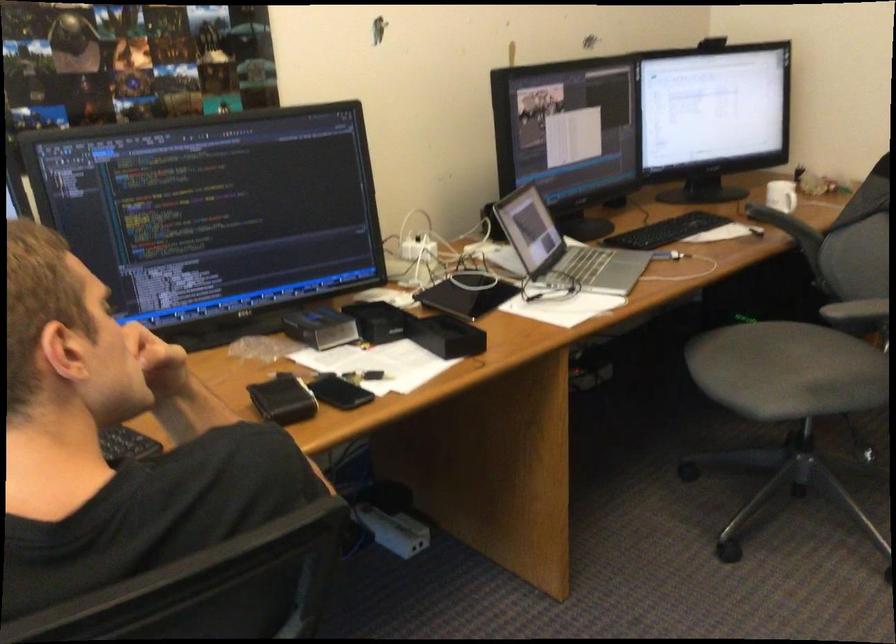
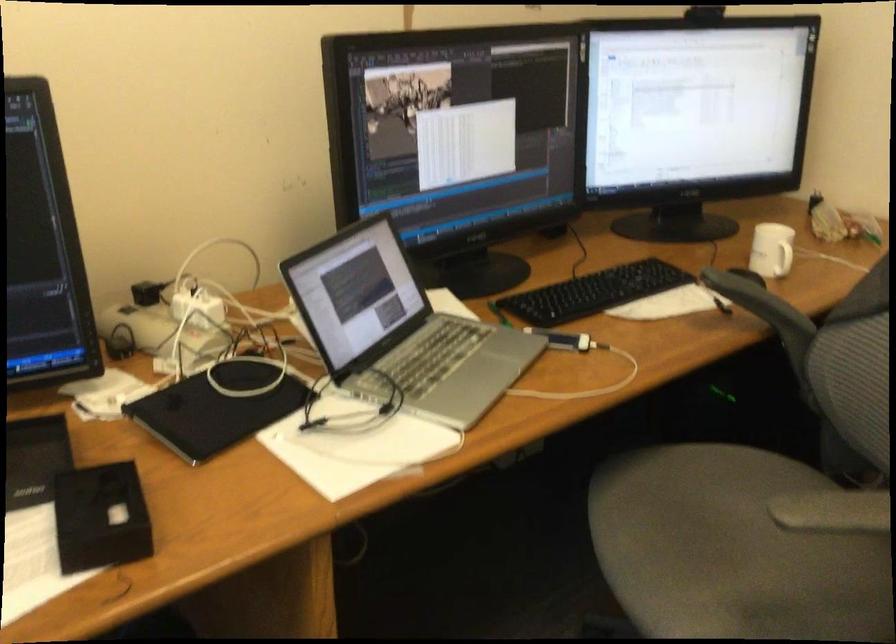
In the second image, find the point that corresponds to (788,371) in the first image.

(733, 550)